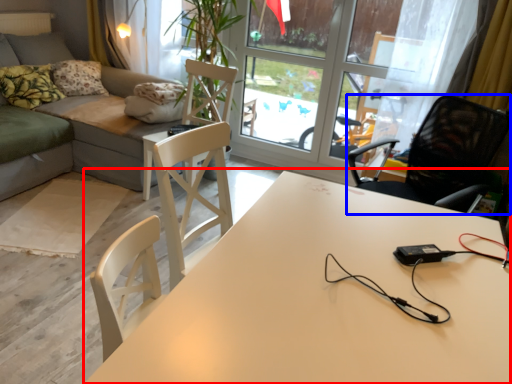
Question: Among these objects, which one is farthest to the camera, table (highlighted by a red box) or chair (highlighted by a blue box)?

Choices:
 (A) table
 (B) chair

Answer: (B)